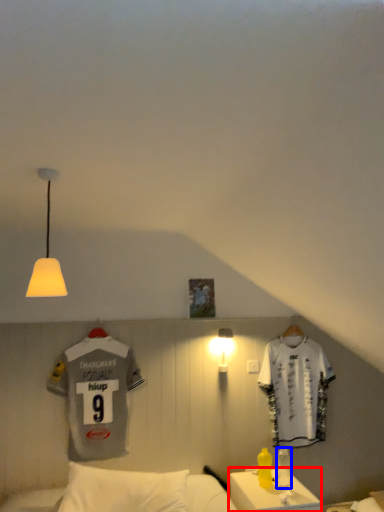
Question: Which point is closer to the camera, table (highlighted by a red box) or bottle (highlighted by a blue box)?

Choices:
 (A) table
 (B) bottle

Answer: (A)